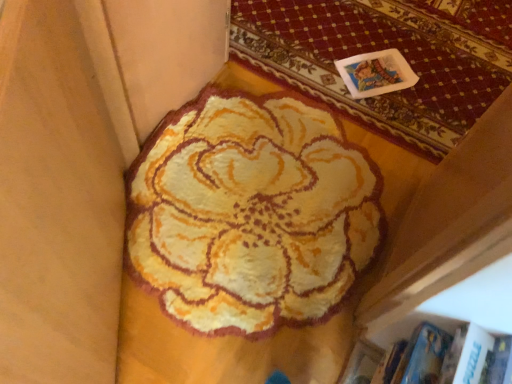
Question: From a real-world perspective, does fluffy yellow rug at upper center stand above fluffy yellow rug at center?

Choices:
 (A) yes
 (B) no

Answer: (B)

Question: Is fluffy yellow rug at upper center at the left side of fluffy yellow rug at center?

Choices:
 (A) no
 (B) yes

Answer: (A)

Question: From the image's perspective, is fluffy yellow rug at upper center located above fluffy yellow rug at center?

Choices:
 (A) no
 (B) yes

Answer: (B)

Question: Are fluffy yellow rug at upper center and fluffy yellow rug at center beside each other?

Choices:
 (A) no
 (B) yes

Answer: (A)

Question: Is fluffy yellow rug at upper center to the right of fluffy yellow rug at center from the viewer's perspective?

Choices:
 (A) no
 (B) yes

Answer: (B)

Question: Is fluffy yellow rug at upper center oriented away from fluffy yellow rug at center?

Choices:
 (A) no
 (B) yes

Answer: (A)

Question: Is fluffy yellow rug at center next to fluffy yellow rug at upper center and touching it?

Choices:
 (A) yes
 (B) no

Answer: (B)

Question: Is fluffy yellow rug at upper center surrounded by fluffy yellow rug at center?

Choices:
 (A) yes
 (B) no

Answer: (B)

Question: From the image's perspective, would you say fluffy yellow rug at center is positioned over fluffy yellow rug at upper center?

Choices:
 (A) yes
 (B) no

Answer: (B)

Question: From a real-world perspective, is fluffy yellow rug at center below fluffy yellow rug at upper center?

Choices:
 (A) yes
 (B) no

Answer: (B)

Question: Is fluffy yellow rug at center outside fluffy yellow rug at upper center?

Choices:
 (A) no
 (B) yes

Answer: (B)

Question: Can you confirm if fluffy yellow rug at center is bigger than fluffy yellow rug at upper center?

Choices:
 (A) yes
 (B) no

Answer: (A)

Question: In the image, is fluffy yellow rug at center on the left side or the right side of fluffy yellow rug at upper center?

Choices:
 (A) right
 (B) left

Answer: (B)